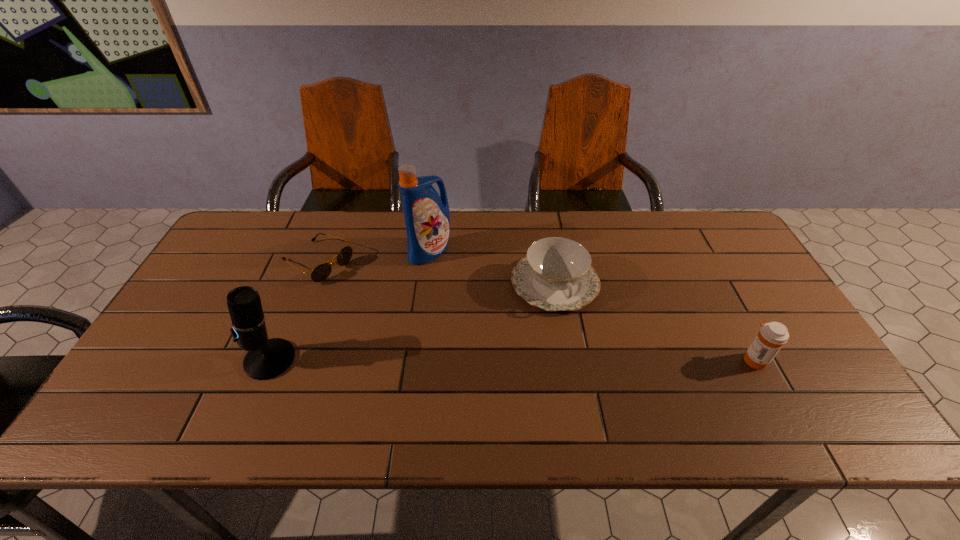
At what (x,y) coordinates should I click in order to perform the action: click on the second tallest object. Please return your answer as a coordinate pair (x, y). Looking at the image, I should click on (267, 358).

You are a GUI agent. You are given a task and a screenshot of the screen. Output one action in this format:
    pyautogui.click(x=<x>, y=<y>)
    Task: Click on the rightmost object
    
    Given the screenshot: What is the action you would take?
    pyautogui.click(x=772, y=336)

Locate an element on the screen. This screenshot has width=960, height=540. the third shortest object is located at coordinates (772, 336).

Locate an element on the screen. the tallest object is located at coordinates (427, 216).

The height and width of the screenshot is (540, 960). I want to click on the third object from left to right, so click(x=427, y=216).

In order to click on the shortest object in this screenshot , I will do `click(321, 272)`.

Image resolution: width=960 pixels, height=540 pixels. I want to click on the second shortest object, so click(556, 274).

Where is `chinaware`? The image size is (960, 540). chinaware is located at coordinates (556, 274).

Identify the location of vacant region located on the left of the microphone. The image size is (960, 540). (198, 360).

At what (x,y) coordinates should I click in order to perform the action: click on vacant space located 0.200m on the left of the medicine. Please return your answer as a coordinate pair (x, y). The image size is (960, 540). Looking at the image, I should click on (662, 360).